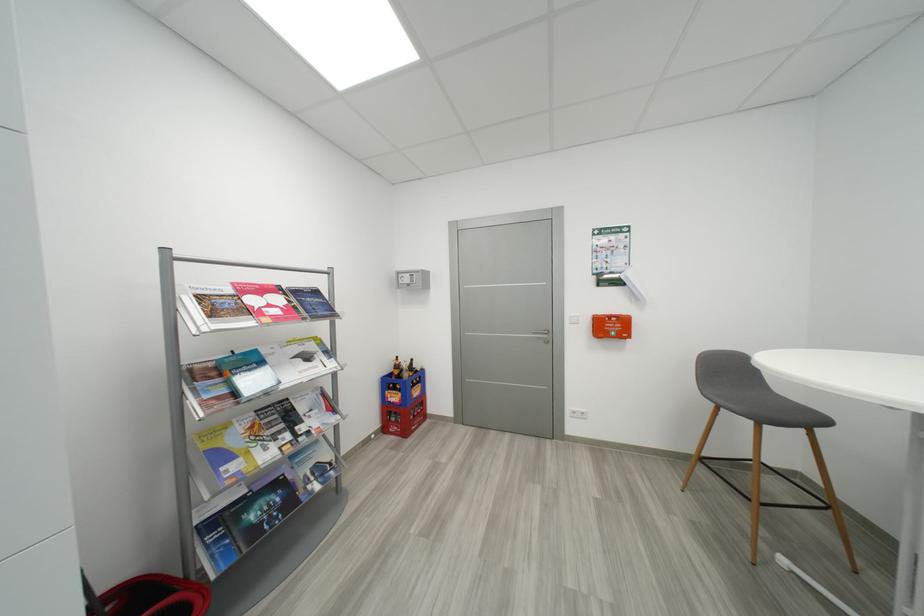
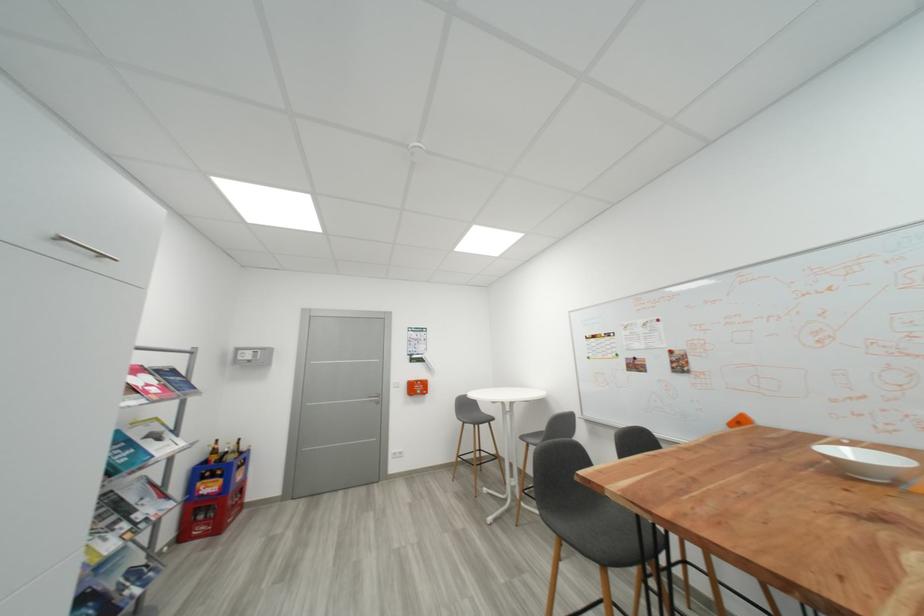
In the second image, find the point that corresponds to (404,369) in the first image.

(223, 454)